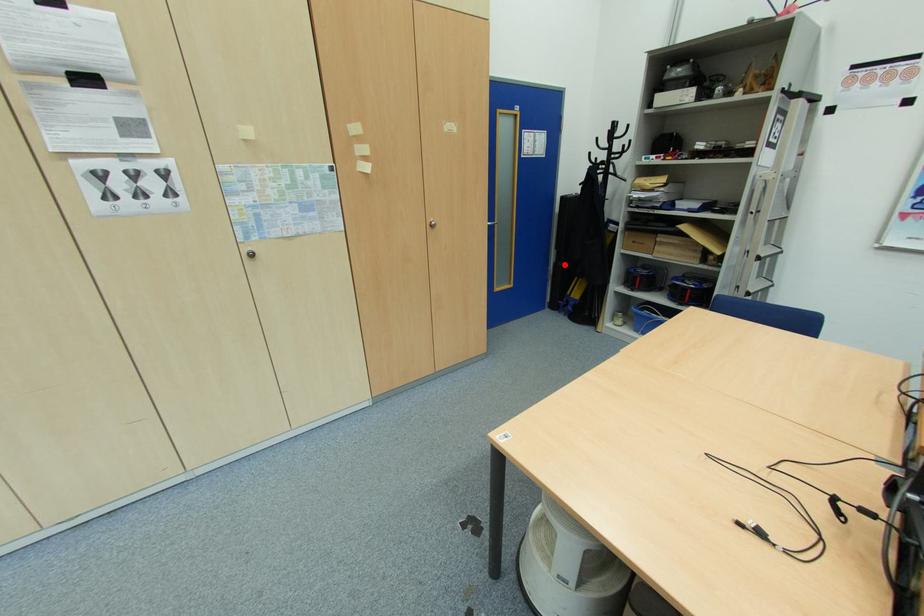
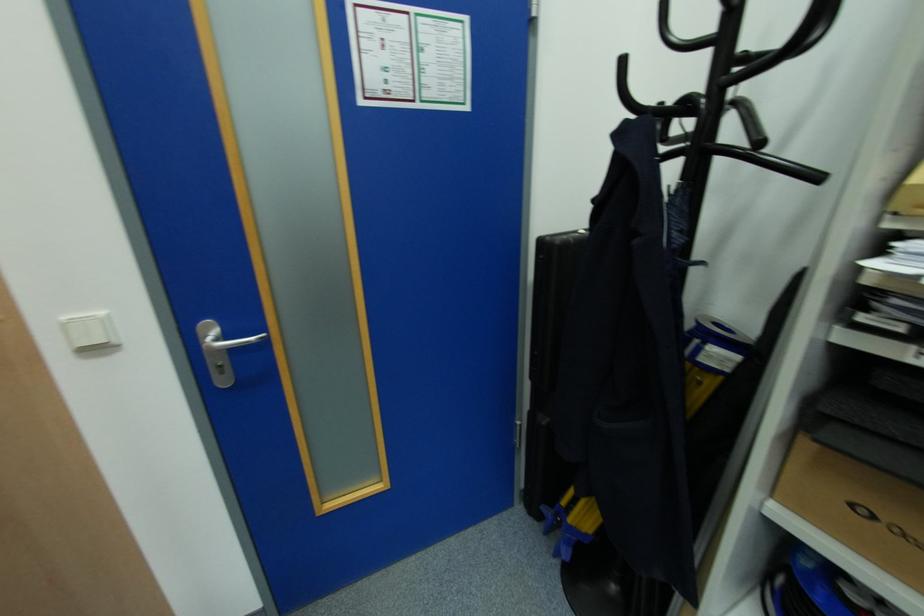
Question: A red point is marked in image1. In image2, is the corresponding 3D point closer to the camera or farther? Reply with the corresponding letter.

Choices:
 (A) The corresponding 3D point is closer.
 (B) The corresponding 3D point is farther.

Answer: (B)